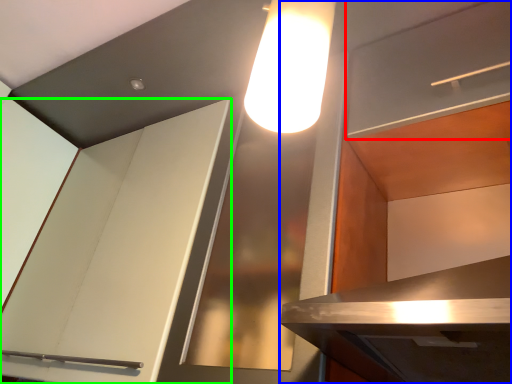
Question: Estimate the real-world distances between objects in this image. Which object is closer to shelf (highlighted by a red box), cabinetry (highlighted by a blue box) or cabinetry (highlighted by a green box)?

Choices:
 (A) cabinetry
 (B) cabinetry

Answer: (A)